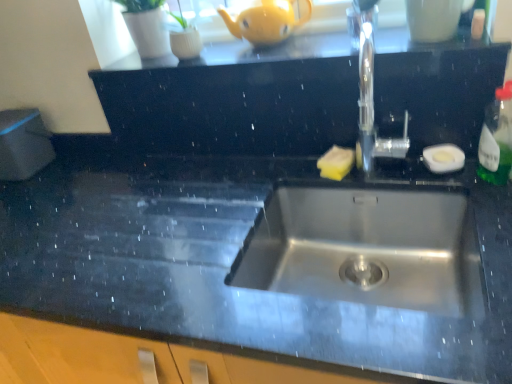
I want to click on free region on the left part of green translucent bottle at right, so click(417, 170).